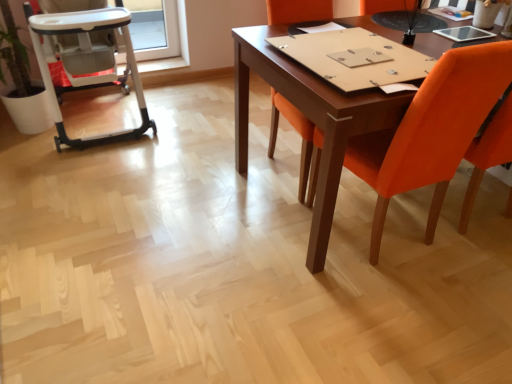
Question: From the image's perspective, is orange fabric chair at center, acting as the first chair starting from the left, positioned above or below white plastic high chair at left?

Choices:
 (A) below
 (B) above

Answer: (A)

Question: Looking at their shapes, would you say orange fabric chair at center, acting as the first chair starting from the left, is wider or thinner than white plastic high chair at left?

Choices:
 (A) thin
 (B) wide

Answer: (A)

Question: Estimate the real-world distances between objects in this image. Which object is farther from the white plastic high chair at left?

Choices:
 (A) orange fabric chair at right, which ranks as the 1th chair in right-to-left order
 (B) orange fabric chair at center, acting as the first chair starting from the left

Answer: (A)

Question: Estimate the real-world distances between objects in this image. Which object is closer to the orange fabric chair at right, which ranks as the 1th chair in right-to-left order?

Choices:
 (A) orange fabric chair at center, the 2th chair when ordered from right to left
 (B) white plastic high chair at left

Answer: (A)